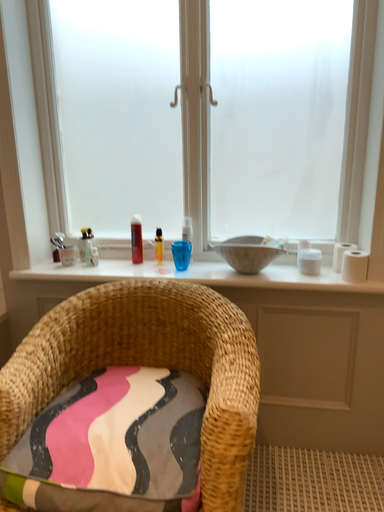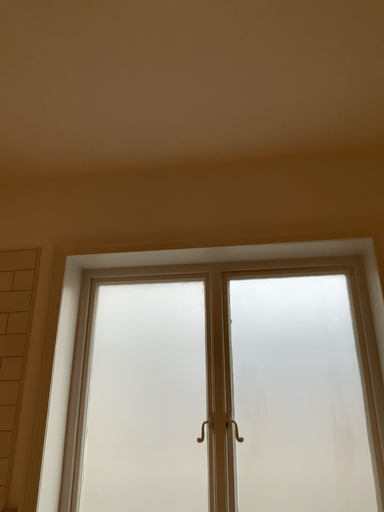
Question: Which way did the camera rotate in the video?

Choices:
 (A) rotated downward
 (B) rotated upward

Answer: (B)